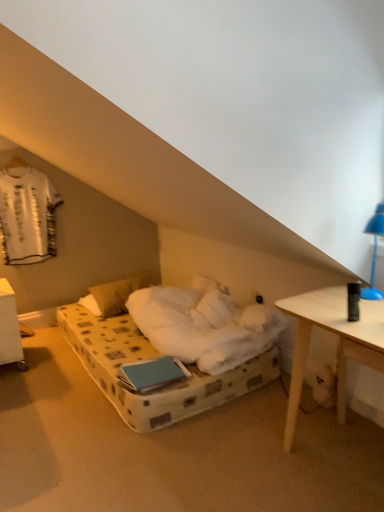
Question: Can you confirm if blue plastic lamp at upper right is smaller than white plastic nightstand at lower left?

Choices:
 (A) yes
 (B) no

Answer: (A)

Question: Considering the relative sizes of blue plastic lamp at upper right and white plastic nightstand at lower left in the image provided, is blue plastic lamp at upper right thinner than white plastic nightstand at lower left?

Choices:
 (A) no
 (B) yes

Answer: (B)

Question: Considering the relative positions of blue plastic lamp at upper right and white plastic nightstand at lower left in the image provided, is blue plastic lamp at upper right to the left of white plastic nightstand at lower left from the viewer's perspective?

Choices:
 (A) no
 (B) yes

Answer: (A)

Question: From a real-world perspective, is blue plastic lamp at upper right located beneath white plastic nightstand at lower left?

Choices:
 (A) yes
 (B) no

Answer: (B)

Question: Considering the relative sizes of blue plastic lamp at upper right and white plastic nightstand at lower left in the image provided, is blue plastic lamp at upper right shorter than white plastic nightstand at lower left?

Choices:
 (A) yes
 (B) no

Answer: (A)

Question: Is blue plastic lamp at upper right beside white plastic nightstand at lower left?

Choices:
 (A) yes
 (B) no

Answer: (B)

Question: From a real-world perspective, is white plastic nightstand at lower left located higher than white soft pillow at center?

Choices:
 (A) yes
 (B) no

Answer: (A)

Question: Is white plastic nightstand at lower left in contact with white soft pillow at center?

Choices:
 (A) yes
 (B) no

Answer: (B)

Question: Is white plastic nightstand at lower left closer to camera compared to white soft pillow at center?

Choices:
 (A) yes
 (B) no

Answer: (A)

Question: Does white plastic nightstand at lower left have a larger size compared to white soft pillow at center?

Choices:
 (A) yes
 (B) no

Answer: (B)

Question: From the image's perspective, is white plastic nightstand at lower left on white soft pillow at center?

Choices:
 (A) yes
 (B) no

Answer: (B)

Question: Does white plastic nightstand at lower left have a greater width compared to white soft pillow at center?

Choices:
 (A) no
 (B) yes

Answer: (B)

Question: Is white plastic nightstand at lower left positioned in front of white fabric shirt at upper left?

Choices:
 (A) no
 (B) yes

Answer: (B)